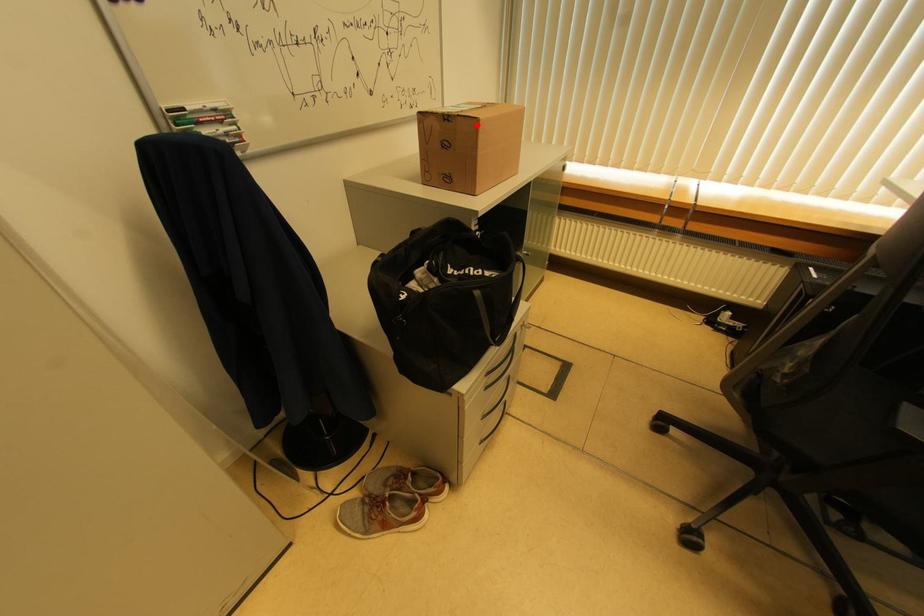
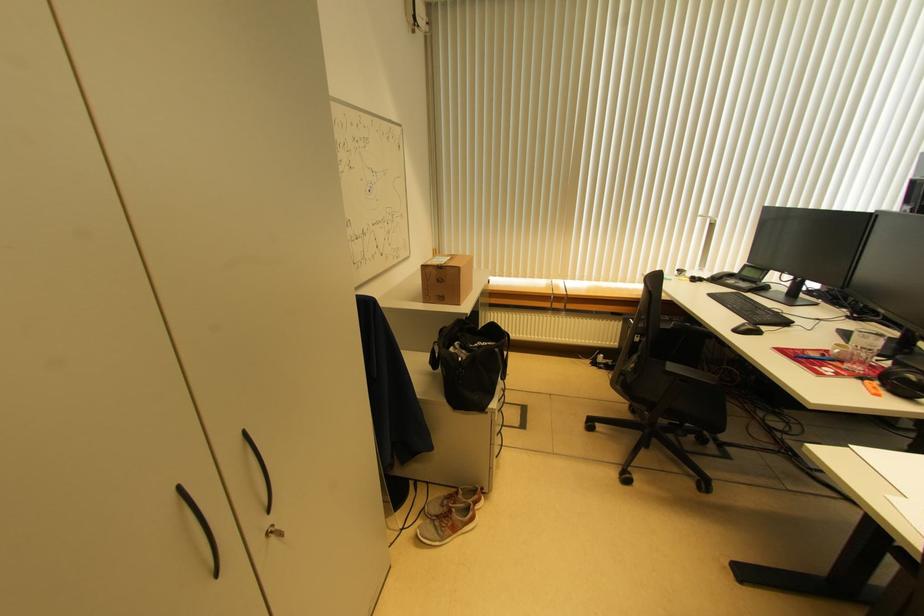
Locate, in the second image, the point that corresponds to the highlighted location in the first image.

(459, 272)